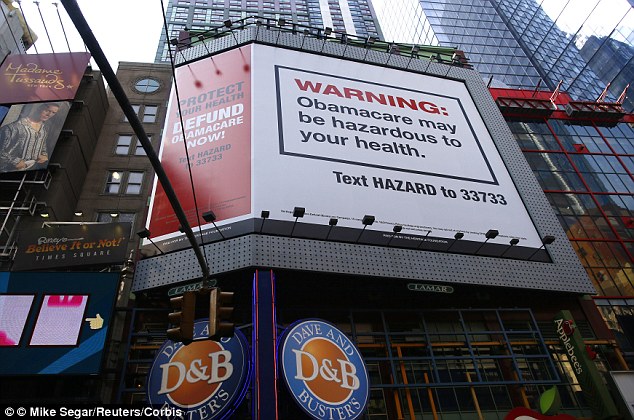
Identify the location of glass. The width and height of the screenshot is (634, 420). [510, 55].